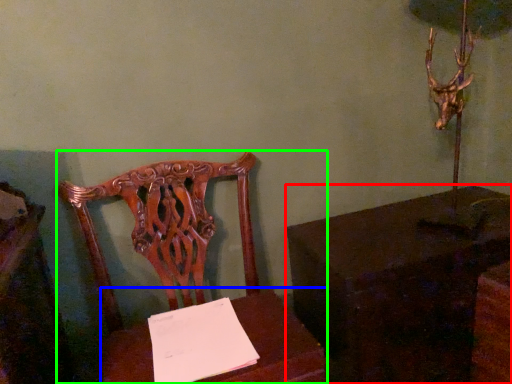
Question: Based on their relative distances, which object is nearer to table (highlighted by a red box)? Choose from table (highlighted by a blue box) and chair (highlighted by a green box).

Choices:
 (A) table
 (B) chair

Answer: (A)